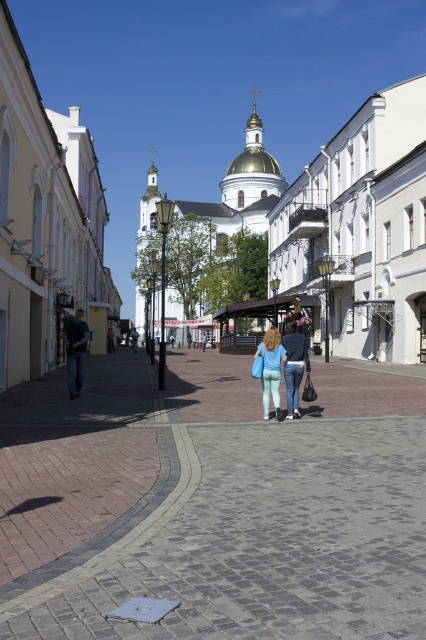
Question: Which of the following is the closest to the observer?

Choices:
 (A) (129, 410)
 (B) (294, 388)

Answer: (B)

Question: Among these objects, which one is nearest to the camera?

Choices:
 (A) denim pants at center
 (B) gray cobblestone pavement at center

Answer: (B)

Question: Does gray cobblestone pavement at center lie behind denim pants at center?

Choices:
 (A) yes
 (B) no

Answer: (B)

Question: Can you confirm if gray cobblestone pavement at center is positioned above denim pants at center?

Choices:
 (A) no
 (B) yes

Answer: (A)

Question: Where is gray cobblestone pavement at center located in relation to denim pants at center in the image?

Choices:
 (A) below
 (B) above

Answer: (A)